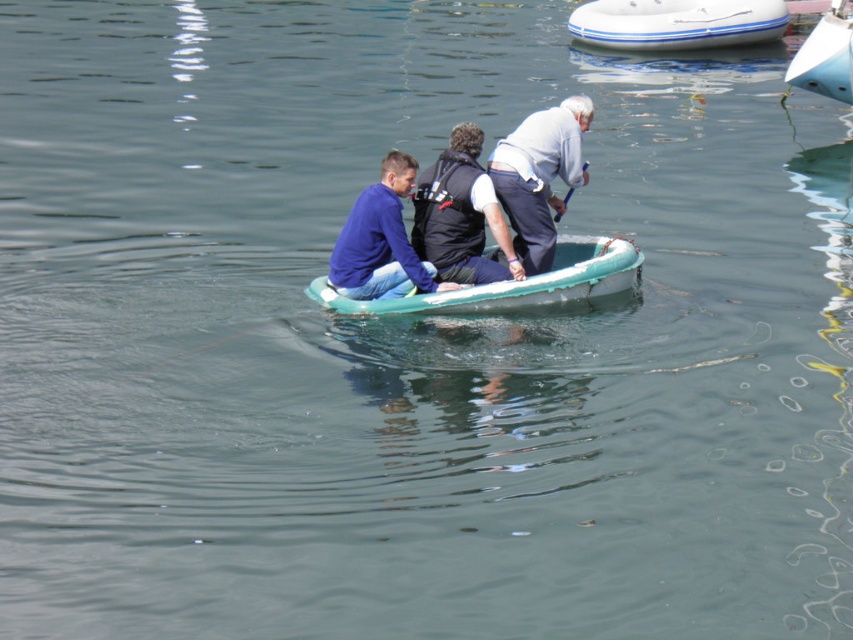
Question: Which object is farther from the camera taking this photo?

Choices:
 (A) white cotton shirt at upper center
 (B) matte blue shirt at center

Answer: (A)

Question: Estimate the real-world distances between objects in this image. Which object is farther from the white rubber boat at upper center?

Choices:
 (A) teal rubber boat at center
 (B) black matte vest at center
 (C) white cotton shirt at upper center

Answer: (B)

Question: Which point is closer to the camera taking this photo?

Choices:
 (A) (392, 304)
 (B) (428, 252)
 (C) (531, 166)

Answer: (A)

Question: Is teal rubber boat at center above white glossy boat at upper right?

Choices:
 (A) yes
 (B) no

Answer: (B)

Question: From the image, what is the correct spatial relationship of teal rubber boat at center in relation to white glossy boat at upper right?

Choices:
 (A) below
 (B) above

Answer: (A)

Question: Does black matte vest at center appear over white glossy boat at upper right?

Choices:
 (A) yes
 (B) no

Answer: (B)